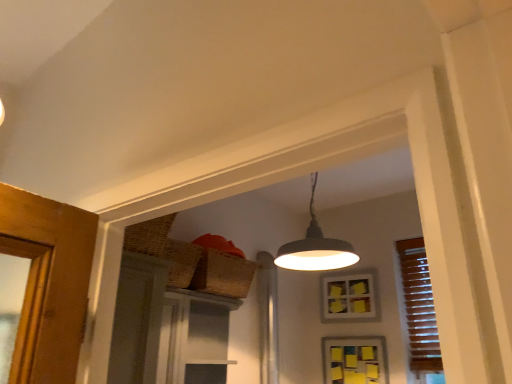
Question: From the image's perspective, is matte gray lampshade at upper center located above or below yellow paper at upper center, which is the second window in top-to-bottom order?

Choices:
 (A) below
 (B) above

Answer: (B)

Question: Considering their positions, is matte gray lampshade at upper center located in front of or behind yellow paper at upper center, which is the second window in top-to-bottom order?

Choices:
 (A) front
 (B) behind

Answer: (A)

Question: Based on their relative distances, which object is nearer to the yellow sticky notes at center, which is the 2th window in bottom-to-top order?

Choices:
 (A) matte gray screen door at center
 (B) yellow paper at upper center, which is the second window in top-to-bottom order
 (C) matte gray lampshade at upper center

Answer: (B)

Question: Which of these objects is positioned farthest from the matte gray screen door at center?

Choices:
 (A) yellow paper at upper center, which is the second window in top-to-bottom order
 (B) matte gray lampshade at upper center
 (C) yellow sticky notes at center, acting as the first window starting from the top

Answer: (C)